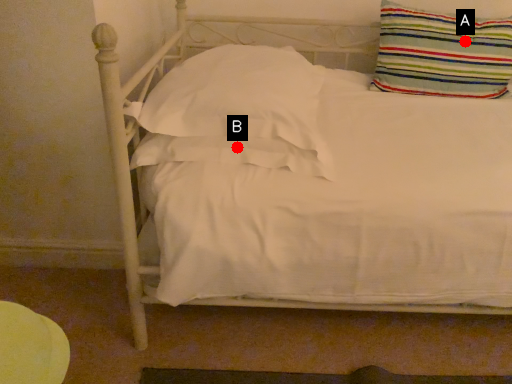
Question: Two points are circled on the image, labeled by A and B beside each circle. Which of the following is the closest to the observer?

Choices:
 (A) A is closer
 (B) B is closer

Answer: (B)